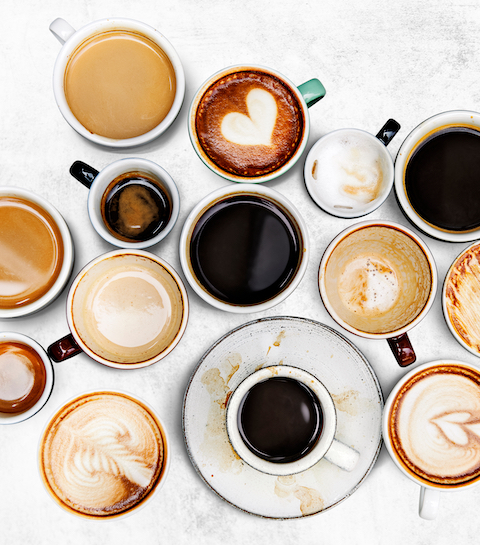
You are a GUI agent. You are given a task and a screenshot of the screen. Output one action in this format:
    pyautogui.click(x=<x>, y=<y>)
    Task: Click on the mug handle
    The height and width of the screenshot is (545, 480).
    Given the screenshot: What is the action you would take?
    pyautogui.click(x=65, y=33), pyautogui.click(x=87, y=173), pyautogui.click(x=71, y=352), pyautogui.click(x=317, y=90), pyautogui.click(x=391, y=129), pyautogui.click(x=405, y=351), pyautogui.click(x=348, y=460)